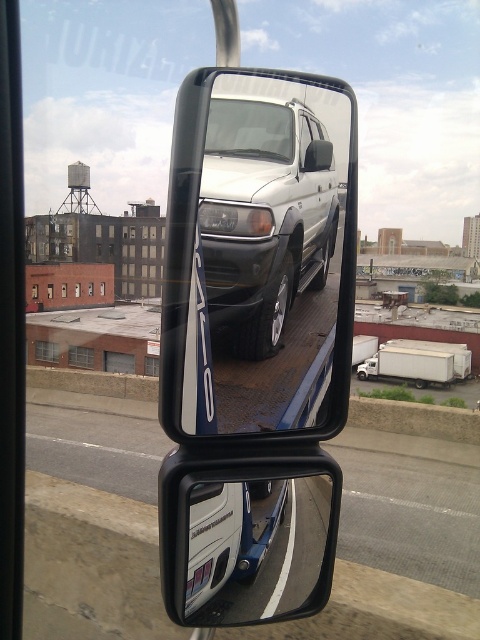
Question: Is glossy metallic van at lower right positioned behind white plastic license plate at lower center?

Choices:
 (A) no
 (B) yes

Answer: (A)

Question: Can you confirm if satin silver suv at center is positioned below glossy metallic van at lower right?

Choices:
 (A) yes
 (B) no

Answer: (B)

Question: Which object appears farthest from the camera in this image?

Choices:
 (A) white plastic license plate at lower center
 (B) glossy metallic van at lower right
 (C) satin silver suv at center

Answer: (A)

Question: Among these points, which one is farthest from the camera?

Choices:
 (A) (193, 595)
 (B) (245, 156)

Answer: (B)

Question: Does satin silver suv at center appear under white plastic license plate at lower center?

Choices:
 (A) no
 (B) yes

Answer: (A)

Question: Which point is farther to the camera?

Choices:
 (A) white plastic license plate at lower center
 (B) satin silver suv at center
 (C) glossy metallic van at lower right

Answer: (A)